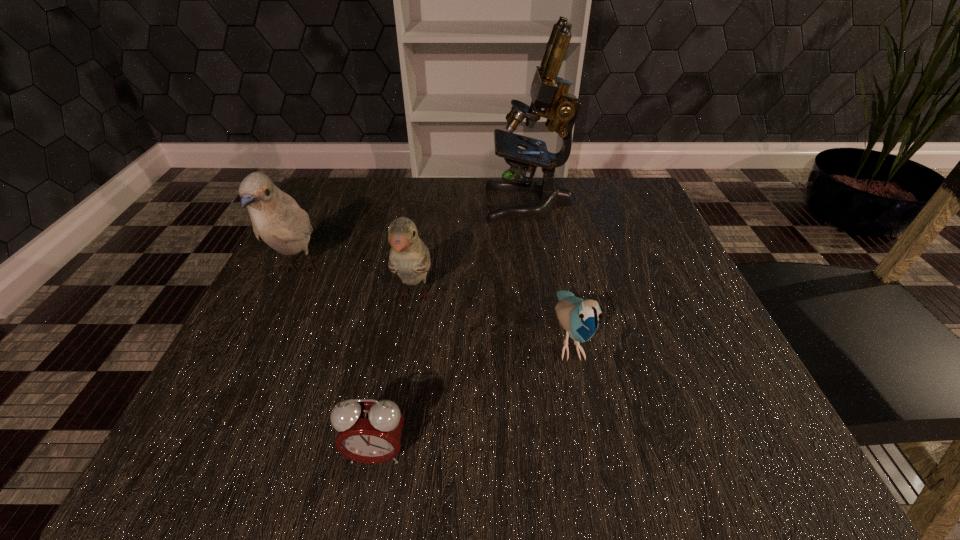
Where is `vacant space located 0.390m at the eyepieces of the farthest object`? This screenshot has width=960, height=540. vacant space located 0.390m at the eyepieces of the farthest object is located at coordinates (314, 203).

Locate an element on the screen. This screenshot has height=540, width=960. vacant space situated at the eyepieces of the farthest object is located at coordinates (362, 203).

Locate an element on the screen. vacant space located at the eyepieces of the farthest object is located at coordinates (416, 203).

The height and width of the screenshot is (540, 960). I want to click on free location located at the beak of the leftmost bird, so click(249, 374).

Image resolution: width=960 pixels, height=540 pixels. What are the coordinates of `vacant position located at the face of the third tallest object` in the screenshot? It's located at (389, 460).

At what (x,y) coordinates should I click in order to perform the action: click on blank space located at the face of the shortest bird. Please return your answer as a coordinate pair (x, y). The height and width of the screenshot is (540, 960). Looking at the image, I should click on (593, 455).

Where is `object at the far edge`? object at the far edge is located at coordinates point(548,91).

The width and height of the screenshot is (960, 540). In order to click on object located in the near edge section of the desktop in this screenshot , I will do `click(370, 431)`.

I want to click on object that is at the left edge, so click(x=277, y=219).

Image resolution: width=960 pixels, height=540 pixels. Find the location of `vacant position at the far edge of the desktop`. vacant position at the far edge of the desktop is located at coordinates (523, 192).